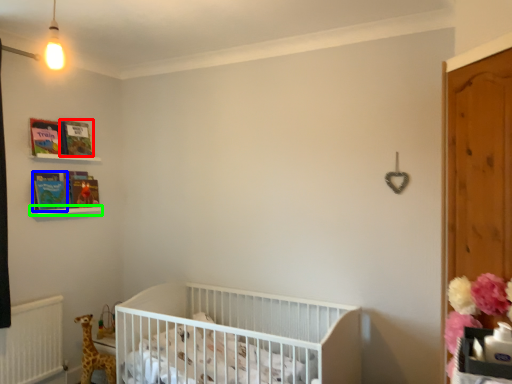
Question: Which is farther away from book (highlighted by a red box)? book (highlighted by a blue box) or balustrade (highlighted by a green box)?

Choices:
 (A) book
 (B) balustrade

Answer: (B)